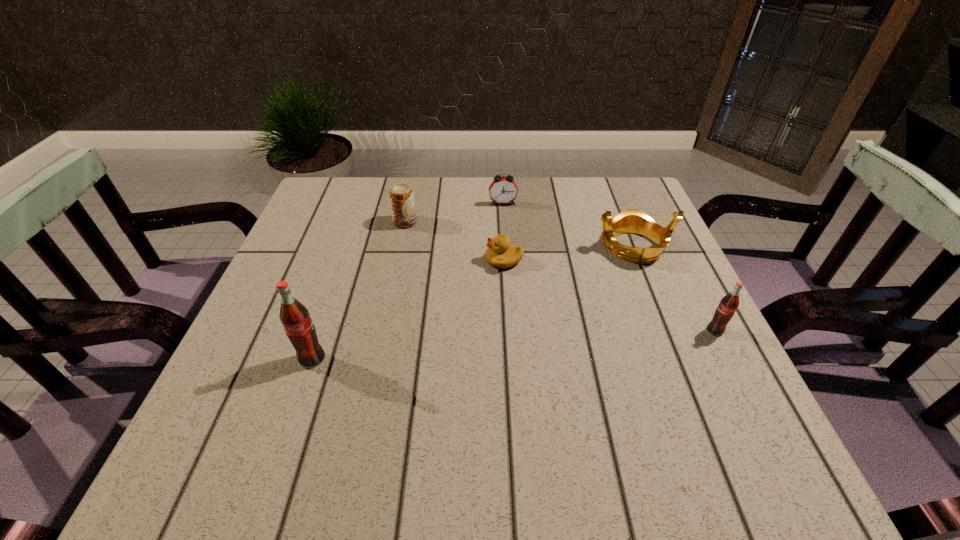
At what (x,y) coordinates should I click in order to perform the action: click on object that is at the left edge. Please return your answer as a coordinate pair (x, y). The width and height of the screenshot is (960, 540). Looking at the image, I should click on (295, 318).

In order to click on soda bottle that is at the right edge in this screenshot , I will do `click(729, 303)`.

Find the location of a particular element. tiara present at the right edge is located at coordinates (629, 221).

Where is `vacant space at the far edge of the desktop`? The width and height of the screenshot is (960, 540). vacant space at the far edge of the desktop is located at coordinates (470, 181).

Locate an element on the screen. vacant space at the near edge of the desktop is located at coordinates (492, 396).

In the image, there is a desktop. At what (x,y) coordinates should I click in order to perform the action: click on vacant space at the left edge. Please return your answer as a coordinate pair (x, y). This screenshot has height=540, width=960. Looking at the image, I should click on (324, 303).

This screenshot has width=960, height=540. Find the location of `vacant space at the right edge of the desktop`. vacant space at the right edge of the desktop is located at coordinates (644, 270).

This screenshot has width=960, height=540. In the image, there is a desktop. Find the location of `vacant space at the far left corner`. vacant space at the far left corner is located at coordinates (358, 193).

This screenshot has width=960, height=540. What are the coordinates of `vacant space at the far right corner` in the screenshot? It's located at (604, 186).

Where is `empty space that is in between the shorter soda bottle and the leftmost object`? The height and width of the screenshot is (540, 960). empty space that is in between the shorter soda bottle and the leftmost object is located at coordinates [514, 345].